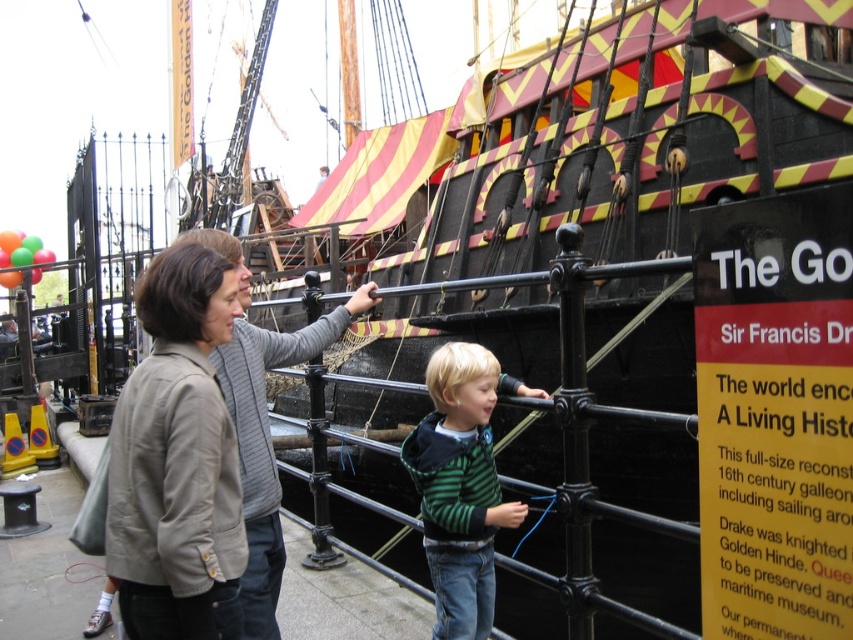
Question: Which point appears closest to the camera in this image?

Choices:
 (A) (457, 392)
 (B) (155, 397)

Answer: (B)

Question: Does light brown fabric jacket at center have a smaller size compared to green striped sweater at center?

Choices:
 (A) no
 (B) yes

Answer: (A)

Question: Which object appears closest to the camera in this image?

Choices:
 (A) green striped sweater at center
 (B) light brown fabric jacket at center

Answer: (B)

Question: Can you confirm if light brown fabric jacket at center is smaller than green striped sweater at center?

Choices:
 (A) no
 (B) yes

Answer: (A)

Question: Does light brown fabric jacket at center have a greater width compared to green striped sweater at center?

Choices:
 (A) yes
 (B) no

Answer: (A)